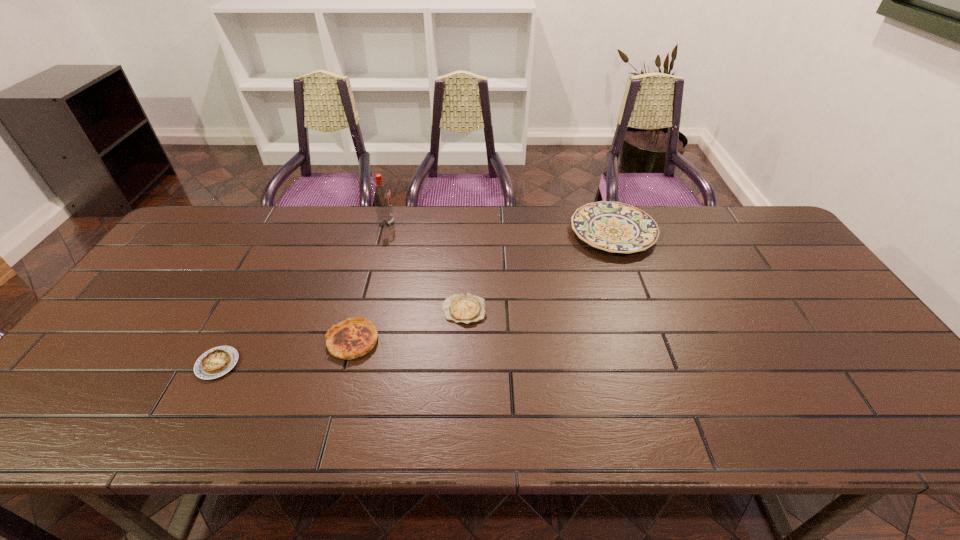
This screenshot has height=540, width=960. In order to click on the tallest object in this screenshot , I will do `click(381, 194)`.

Locate an element on the screen. This screenshot has height=540, width=960. plate is located at coordinates (615, 227).

Identify the location of the second quiche from right to left. (352, 338).

The width and height of the screenshot is (960, 540). Identify the location of the leftmost quiche. (216, 362).

The width and height of the screenshot is (960, 540). Find the location of `the second shortest quiche`. the second shortest quiche is located at coordinates (216, 362).

I want to click on the fourth object from left to right, so pos(466,308).

Locate an element on the screen. the shortest object is located at coordinates (466, 308).

You are a GUI agent. You are given a task and a screenshot of the screen. Output one action in this format:
    pyautogui.click(x=<x>, y=<y>)
    Task: Click on the vacant area situated 0.130m on the front label of the vodka
    The image size is (960, 540).
    Given the screenshot: What is the action you would take?
    pyautogui.click(x=434, y=224)

This screenshot has width=960, height=540. In order to click on free space located 0.080m on the right of the rightmost object in this screenshot , I will do `click(681, 232)`.

Find the location of a particular element. The width and height of the screenshot is (960, 540). free region located 0.250m on the back of the tallest quiche is located at coordinates (374, 259).